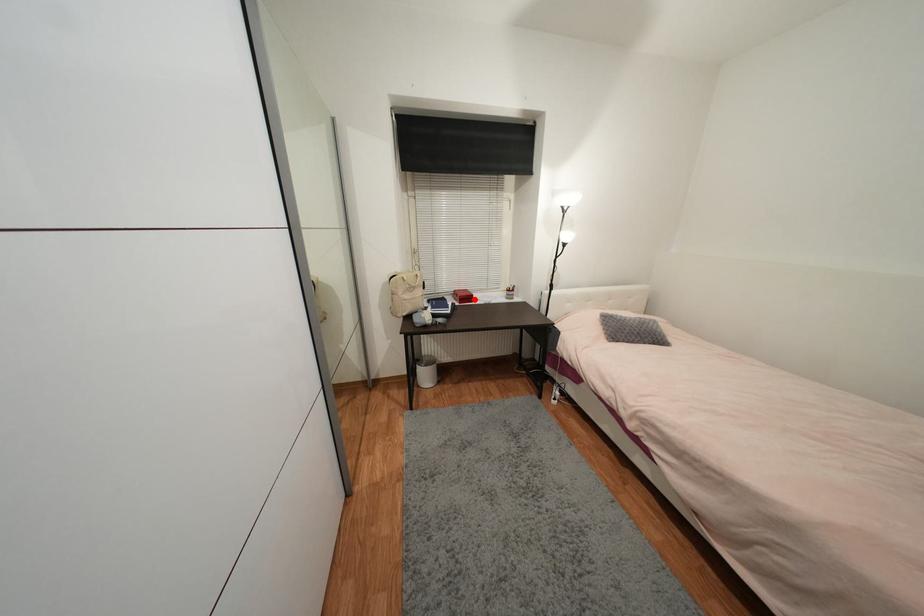
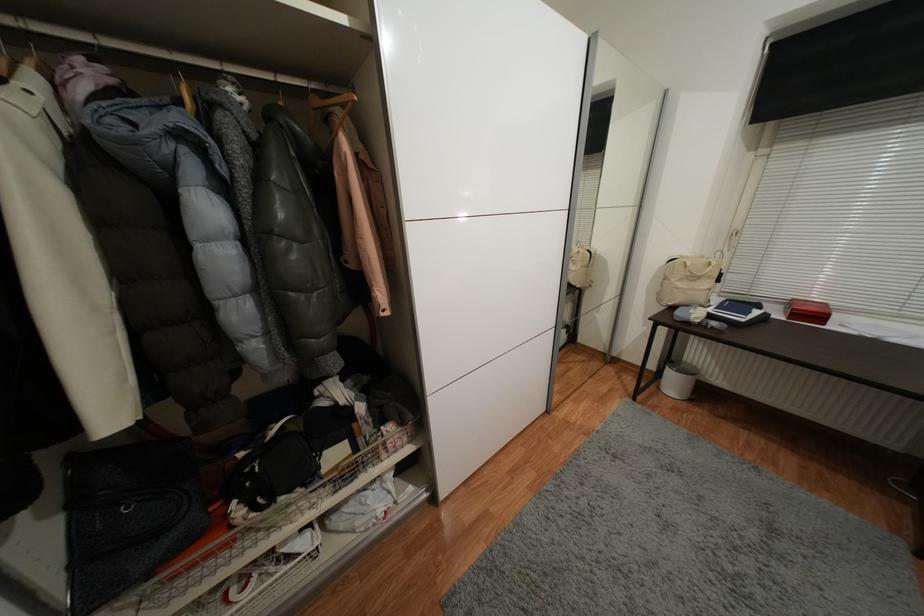
In the second image, find the point that corresponds to the highlighted location in the first image.

(824, 318)